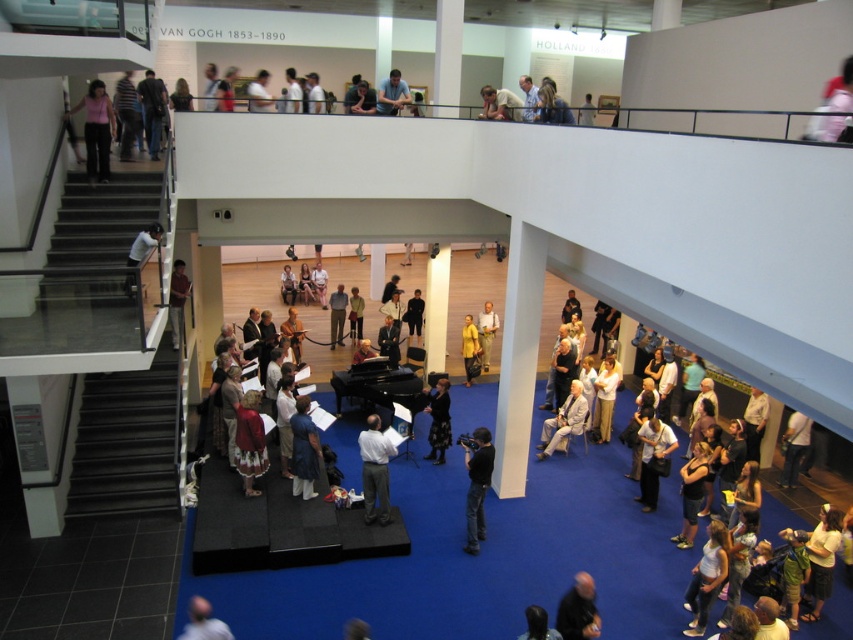
You are at the entrance of the museum and want to find the performer wearing the yellow matte shirt at center. Based on the scene description, where should you look relative to the stage?

The yellow matte shirt at center is located at point (486, 333), which is on the stage area in the center of the room. You should look towards the center stage where the performers are gathered around the black grand piano.

You are a photographer at the event and need to capture a clear shot of both the white shirt at center and the black leather jacket at center. Based on their sizes, which one might be closer to the camera?

The white shirt at center has a smaller size compared to the black leather jacket at center, so the white shirt at center is likely closer to the camera since objects closer to the camera appear smaller.

You are a photographer at the event and need to capture a photo of the dark brown hair at lower center without the matte black camera at lower left appearing in the frame. Is this possible based on their positions?

The matte black camera at lower left is to the left of dark brown hair at lower center, so if you position yourself to the right side of the camera, you can frame the shot to exclude the camera while still capturing the dark brown hair at lower center.